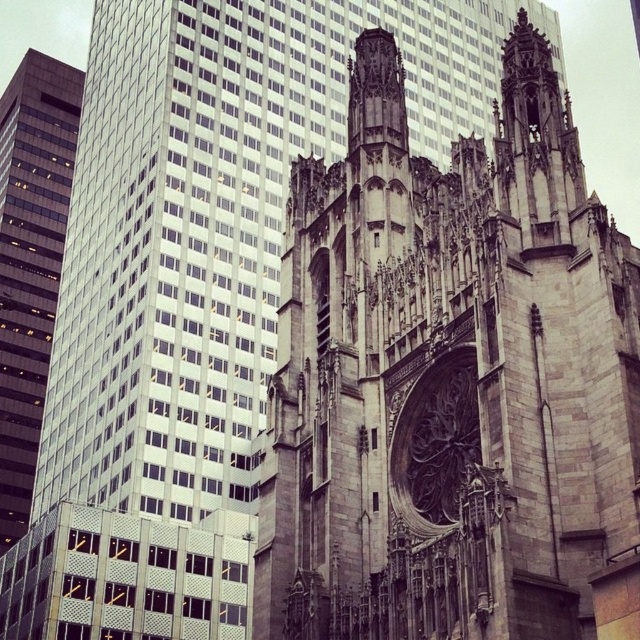
You are standing in the city square and see a point marked at coordinates (452, 381). Based on the scene description, which architectural structure does this point belong to?

The point at coordinates (452, 381) is on the gray stone cathedral at center.

You are standing in the middle of the street between the gray stone cathedral at center and the matte glass skyscraper at left. Which building is closer to your right side?

The gray stone cathedral at center is to the right of the matte glass skyscraper at left, so the gray stone cathedral at center is closer to your right side.

You are a photographer standing at the camera position. You want to capture a photo of the gray stone cathedral at center. The recommended minimum distance for capturing architectural details clearly is 30 meters. Is the current distance sufficient?

The gray stone cathedral at center and camera are 29.84 meters apart, which is slightly less than the recommended 30 meters. The current distance may not be sufficient for capturing architectural details clearly.